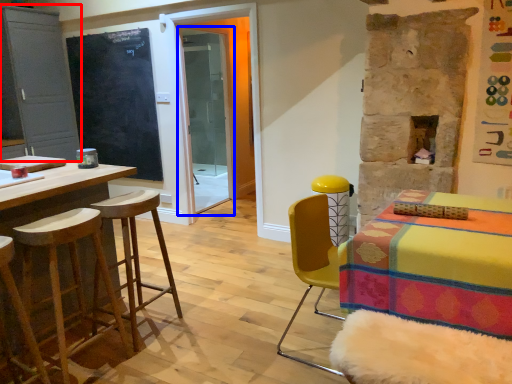
Question: Which object is closer to the camera taking this photo, cabinetry (highlighted by a red box) or screen door (highlighted by a blue box)?

Choices:
 (A) cabinetry
 (B) screen door

Answer: (A)